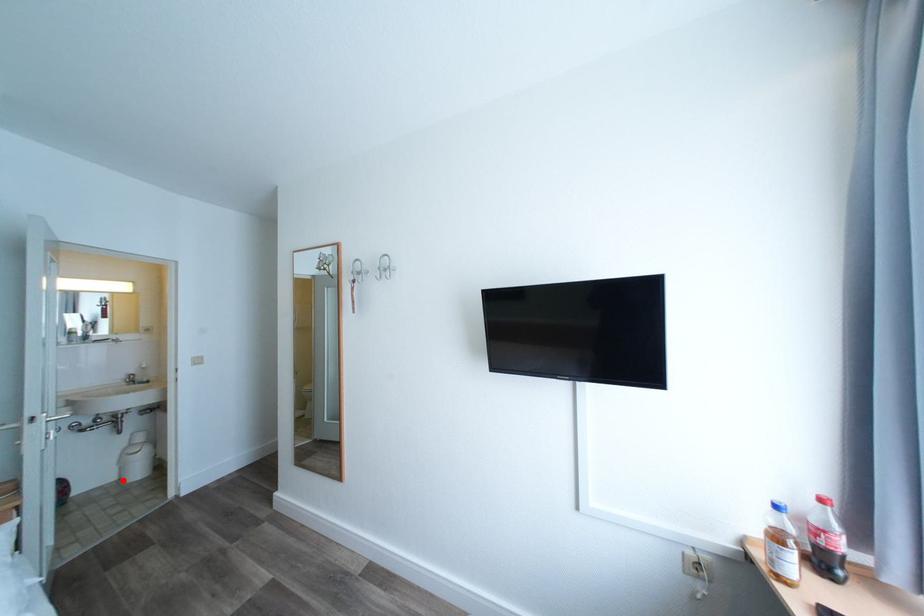
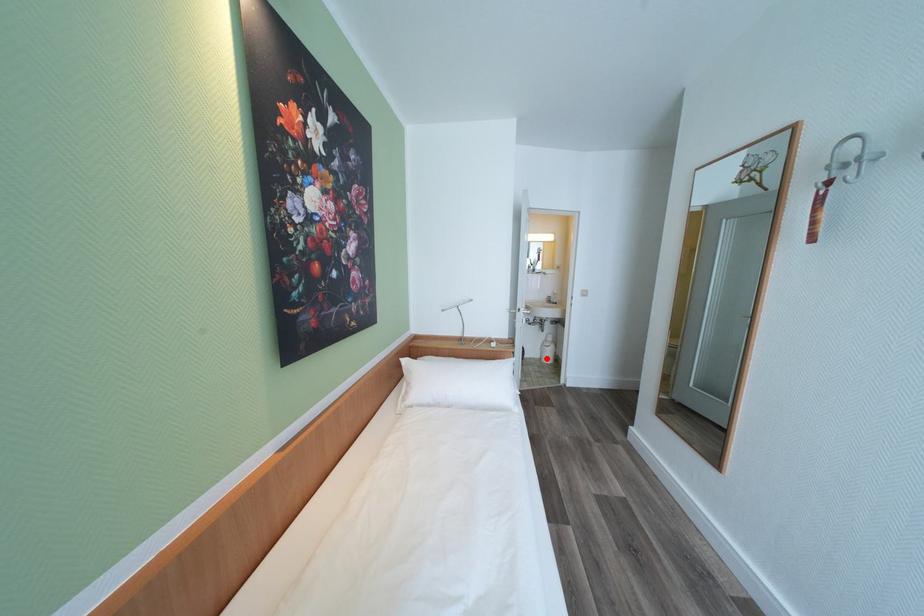
I am providing you with two images of the same scene from different viewpoints. A red point is marked on the first image and another point is marked on the second image. Is the marked point in image1 the same physical position as the marked point in image2?

Yes